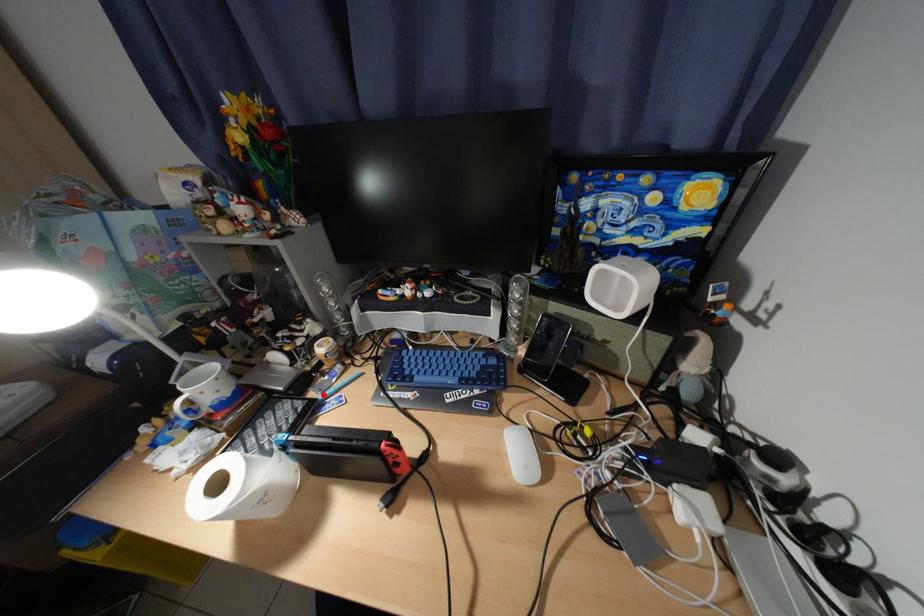
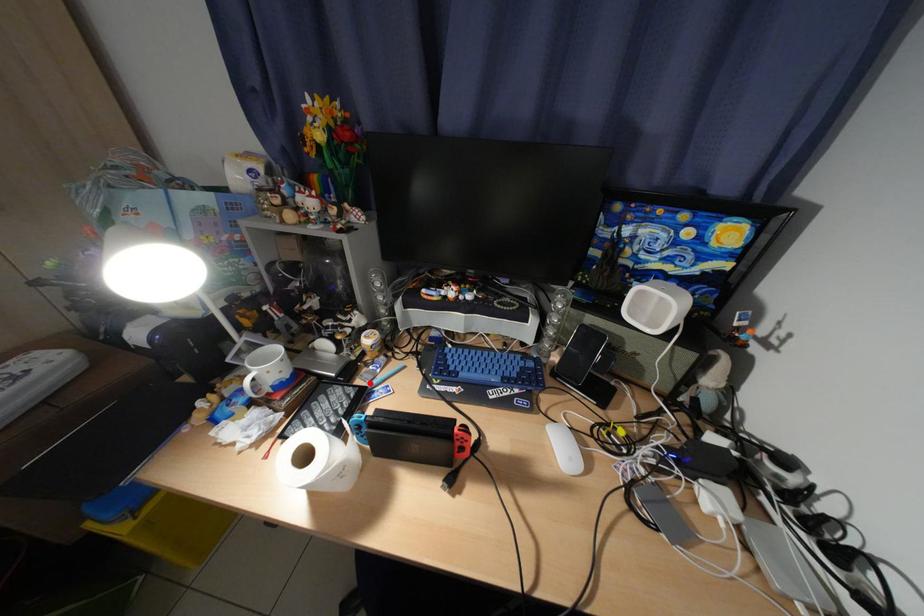
I am providing you with two images of the same scene from different viewpoints. A red point is marked on the first image and another point is marked on the second image. Is the marked point in image1 the same physical position as the marked point in image2?

Yes